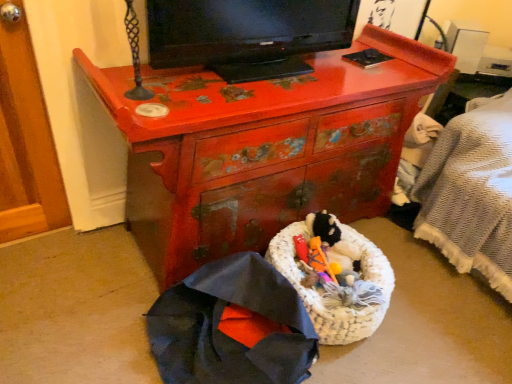
Question: Looking at the image, does cherry wood dresser at center seem bigger or smaller compared to white woven laundry basket at center?

Choices:
 (A) big
 (B) small

Answer: (A)

Question: Considering their positions, is cherry wood dresser at center located in front of or behind white woven laundry basket at center?

Choices:
 (A) behind
 (B) front

Answer: (B)

Question: Which object is the closest to the white woven laundry basket at center?

Choices:
 (A) cherry wood dresser at center
 (B) dark blue fabric umbrella at lower left
 (C) black glossy television at upper center

Answer: (B)

Question: Estimate the real-world distances between objects in this image. Which object is closer to the white woven laundry basket at center?

Choices:
 (A) black glossy television at upper center
 (B) dark blue fabric umbrella at lower left
 (C) cherry wood dresser at center

Answer: (B)